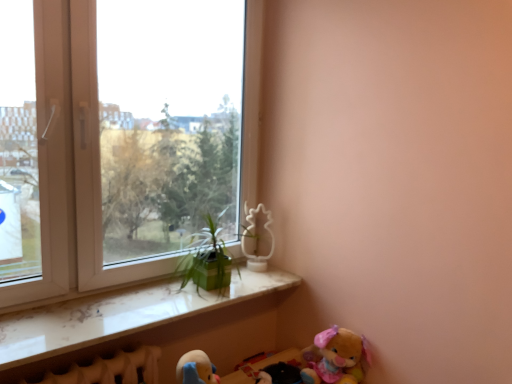
In order to face white matte pineapple at upper center, positioned as the second toy in right-to-left order, should I rotate leftwards or rightwards?

To align with it, rotate right about 0.733°.

Find the location of `white plastic window at upper left`. white plastic window at upper left is located at coordinates (70, 163).

Where is `white matte pineapple at upper center, which is counted as the 2th toy, starting from the bottom`? white matte pineapple at upper center, which is counted as the 2th toy, starting from the bottom is located at coordinates (256, 238).

Measure the distance from white marble window sill at lower left to fluffy plush bear at lower right, the first toy when ordered from right to left.

white marble window sill at lower left is 22.24 inches from fluffy plush bear at lower right, the first toy when ordered from right to left.

Is white marble window sill at lower left turned away from fluffy plush bear at lower right, the first toy when ordered from right to left?

No.

Is white marble window sill at lower left bigger or smaller than fluffy plush bear at lower right, the first toy in the front-to-back sequence?

In the image, white marble window sill at lower left appears to be larger than fluffy plush bear at lower right, the first toy in the front-to-back sequence.

Can you confirm if white marble window sill at lower left is thinner than fluffy plush bear at lower right, the first toy in the front-to-back sequence?

Incorrect, the width of white marble window sill at lower left is not less than that of fluffy plush bear at lower right, the first toy in the front-to-back sequence.

Consider the image. From a real-world perspective, is fluffy plush bear at lower right, arranged as the second toy when viewed from the back, beneath green matte plant at center?

Correct, in the physical world, fluffy plush bear at lower right, arranged as the second toy when viewed from the back, is lower than green matte plant at center.

At what (x,y) coordinates should I click in order to perform the action: click on houseplant on the left of the fluffy plush bear at lower right, the first toy when ordered from right to left. Please return your answer as a coordinate pair (x, y). This screenshot has height=384, width=512. Looking at the image, I should click on (207, 259).

From the image's perspective, which is above, fluffy plush bear at lower right, arranged as the 1th toy when ordered from the bottom, or green matte plant at center?

From the image's view, green matte plant at center is above.

Is white matte pineapple at upper center, which is counted as the 2th toy, starting from the bottom, touching white plastic window at upper left?

There is a gap between white matte pineapple at upper center, which is counted as the 2th toy, starting from the bottom, and white plastic window at upper left.

Considering the relative positions of white matte pineapple at upper center, which is counted as the 2th toy, starting from the bottom, and white plastic window at upper left in the image provided, is white matte pineapple at upper center, which is counted as the 2th toy, starting from the bottom, to the left or to the right of white plastic window at upper left?

In the image, white matte pineapple at upper center, which is counted as the 2th toy, starting from the bottom, appears on the right side of white plastic window at upper left.

Is white matte pineapple at upper center, the 2th toy in the front-to-back sequence, outside of white plastic window at upper left?

No, white matte pineapple at upper center, the 2th toy in the front-to-back sequence, is inside white plastic window at upper left's boundary.

Which is closer to the camera, (254, 102) or (116, 319)?

The point (116, 319) is closer.

Considering the relative positions of white plastic window at upper left and white marble window sill at lower left in the image provided, is white plastic window at upper left behind white marble window sill at lower left?

Yes, it is behind white marble window sill at lower left.

Is white plastic window at upper left not close to white marble window sill at lower left?

No, white plastic window at upper left is not far from white marble window sill at lower left.

Considering the relative sizes of white marble window sill at lower left and green matte plant at center in the image provided, is white marble window sill at lower left wider than green matte plant at center?

Yes.

Is white marble window sill at lower left at the left side of green matte plant at center?

Indeed, white marble window sill at lower left is positioned on the left side of green matte plant at center.

Is white marble window sill at lower left shorter than green matte plant at center?

Indeed, white marble window sill at lower left has a lesser height compared to green matte plant at center.

Is white marble window sill at lower left far from green matte plant at center?

white marble window sill at lower left is near green matte plant at center, not far away.

Does white plastic window at upper left have a lesser height compared to white matte pineapple at upper center, which is the 1th toy in top-to-bottom order?

No.

Consider the image. Measure the distance between white plastic window at upper left and white matte pineapple at upper center, which is counted as the 2th toy, starting from the bottom.

26.99 inches.

From the image's perspective, is white plastic window at upper left located beneath white matte pineapple at upper center, acting as the first toy starting from the back?

Actually, white plastic window at upper left appears above white matte pineapple at upper center, acting as the first toy starting from the back, in the image.

Is white plastic window at upper left aimed at white matte pineapple at upper center, which is the 1th toy in top-to-bottom order?

Yes.

Is white marble window sill at lower left inside or outside of white plastic window at upper left?

The correct answer is: outside.

Is white marble window sill at lower left facing towards white plastic window at upper left?

No, white marble window sill at lower left does not turn towards white plastic window at upper left.

Is white marble window sill at lower left further to camera compared to white plastic window at upper left?

No, the depth of white marble window sill at lower left is less than that of white plastic window at upper left.

Which is nearer, (120, 310) or (55, 182)?

The point (55, 182) is closer to the camera.

Starting from the white marble window sill at lower left, which toy is the 2nd one to the right? Please provide its 2D coordinates.

[(335, 357)]

The image size is (512, 384). Find the location of `houseplant in front of the fluffy plush bear at lower right, arranged as the second toy when viewed from the back`. houseplant in front of the fluffy plush bear at lower right, arranged as the second toy when viewed from the back is located at coordinates click(207, 259).

From the image, which object appears to be nearer to white plastic window at upper left, white marble window sill at lower left or green matte plant at center?

Among the two, white marble window sill at lower left is located nearer to white plastic window at upper left.

Which object lies further to the anchor point white plastic window at upper left, fluffy plush bear at lower right, which is the 2th toy in top-to-bottom order, or white matte pineapple at upper center, positioned as the second toy in right-to-left order?

The object further to white plastic window at upper left is fluffy plush bear at lower right, which is the 2th toy in top-to-bottom order.

Based on their spatial positions, is white matte pineapple at upper center, the 2th toy in the front-to-back sequence, or white marble window sill at lower left further from green matte plant at center?

Based on the image, white marble window sill at lower left appears to be further to green matte plant at center.

When comparing their distances from white plastic window at upper left, does green matte plant at center or white marble window sill at lower left seem closer?

white marble window sill at lower left is closer to white plastic window at upper left.

Looking at the image, which one is located further to white matte pineapple at upper center, which is counted as the 2th toy, starting from the bottom, white plastic window at upper left or white marble window sill at lower left?

white plastic window at upper left lies further to white matte pineapple at upper center, which is counted as the 2th toy, starting from the bottom, than the other object.

Which object lies further to the anchor point fluffy plush bear at lower right, the first toy when ordered from right to left, white marble window sill at lower left or white matte pineapple at upper center, which is counted as the 2th toy, starting from the bottom?

white matte pineapple at upper center, which is counted as the 2th toy, starting from the bottom, is further to fluffy plush bear at lower right, the first toy when ordered from right to left.

Considering their positions, is white marble window sill at lower left positioned closer to white plastic window at upper left than white matte pineapple at upper center, the 1th toy from the left?

white marble window sill at lower left is positioned closer to the anchor white plastic window at upper left.

Considering their positions, is white matte pineapple at upper center, positioned as the second toy in right-to-left order, positioned further to green matte plant at center than white plastic window at upper left?

The object further to green matte plant at center is white plastic window at upper left.

Locate an element on the screen. This screenshot has height=384, width=512. toy between white marble window sill at lower left and white matte pineapple at upper center, which is counted as the 2th toy, starting from the bottom, in the front-back direction is located at coordinates click(335, 357).

You are a GUI agent. You are given a task and a screenshot of the screen. Output one action in this format:
    pyautogui.click(x=<x>, y=<y>)
    Task: Click on the toy between white plastic window at upper left and fluffy plush bear at lower right, positioned as the second toy in left-to-right order, in the up-down direction
    Image resolution: width=512 pixels, height=384 pixels.
    Given the screenshot: What is the action you would take?
    pyautogui.click(x=256, y=238)

The width and height of the screenshot is (512, 384). I want to click on houseplant located between white plastic window at upper left and white matte pineapple at upper center, positioned as the second toy in right-to-left order, in the depth direction, so click(207, 259).

You are a GUI agent. You are given a task and a screenshot of the screen. Output one action in this format:
    pyautogui.click(x=<x>, y=<y>)
    Task: Click on the window sill that lies between white plastic window at upper left and fluffy plush bear at lower right, arranged as the 1th toy when ordered from the bottom, from top to bottom
    
    Given the screenshot: What is the action you would take?
    pyautogui.click(x=120, y=315)